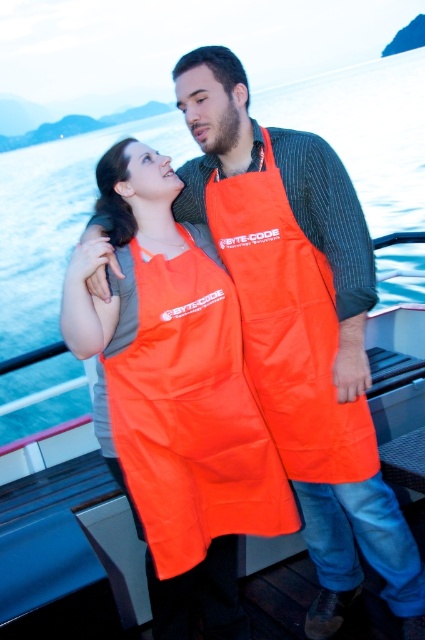
You are a photographer trying to capture a photo of the two people wearing orange aprons. You want to ensure that the person wearing the orange matte apron at center is positioned to the left of the orange fabric apron at center in the final image. Based on the scene, is this arrangement already correct?

Yes, the orange matte apron at center is already positioned to the left of the orange fabric apron at center, so the arrangement is correct.